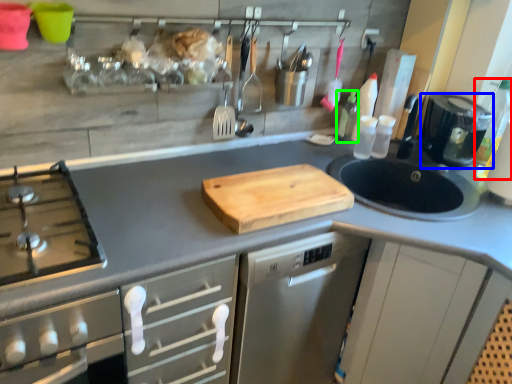
Question: Which object is positioned closest to bottle (highlighted by a red box)? Select from kitchen appliance (highlighted by a blue box) and bottle (highlighted by a green box).

Choices:
 (A) kitchen appliance
 (B) bottle

Answer: (A)